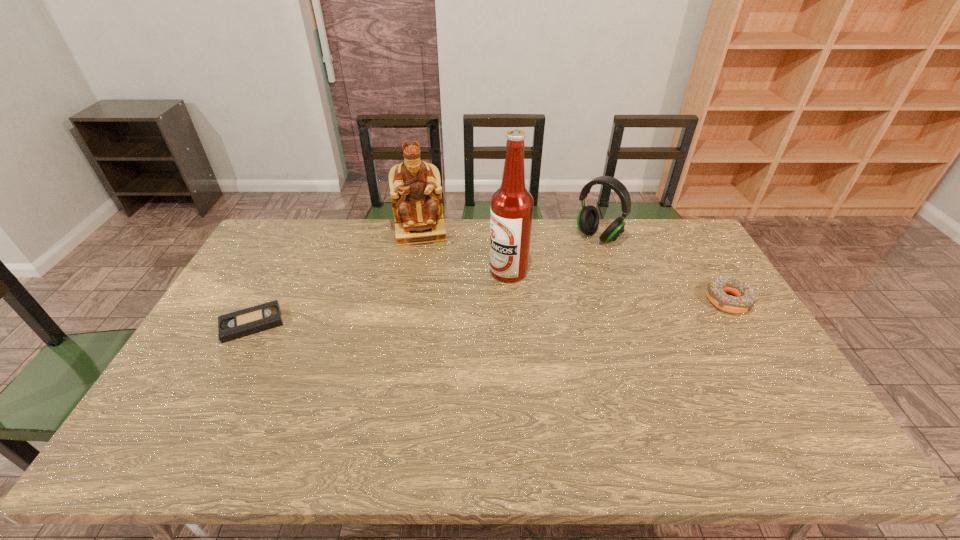
The height and width of the screenshot is (540, 960). I want to click on free spot located on the front of the leftmost object, so click(x=218, y=389).

Identify the location of free space located on the left of the fourth tallest object. (610, 300).

Locate an element on the screen. free point located on the ear cups of the third shortest object is located at coordinates (550, 279).

Image resolution: width=960 pixels, height=540 pixels. Identify the location of free location located on the ear cups of the third shortest object. (570, 261).

This screenshot has width=960, height=540. I want to click on free space located on the ear cups of the third shortest object, so click(x=557, y=273).

The height and width of the screenshot is (540, 960). I want to click on free region located on the label side of the tallest object, so click(435, 321).

Find the location of a particular element. The image size is (960, 540). vacant space situated 0.180m on the label side of the tallest object is located at coordinates (455, 308).

Locate an element on the screen. The image size is (960, 540). free space located on the label side of the tallest object is located at coordinates pos(429,325).

At what (x,y) coordinates should I click in order to perform the action: click on free space located 0.150m on the front-facing side of the second object from left to right. Please return your answer as a coordinate pair (x, y). The height and width of the screenshot is (540, 960). Looking at the image, I should click on (425, 274).

This screenshot has height=540, width=960. I want to click on free space located 0.160m on the front-facing side of the second object from left to right, so click(425, 275).